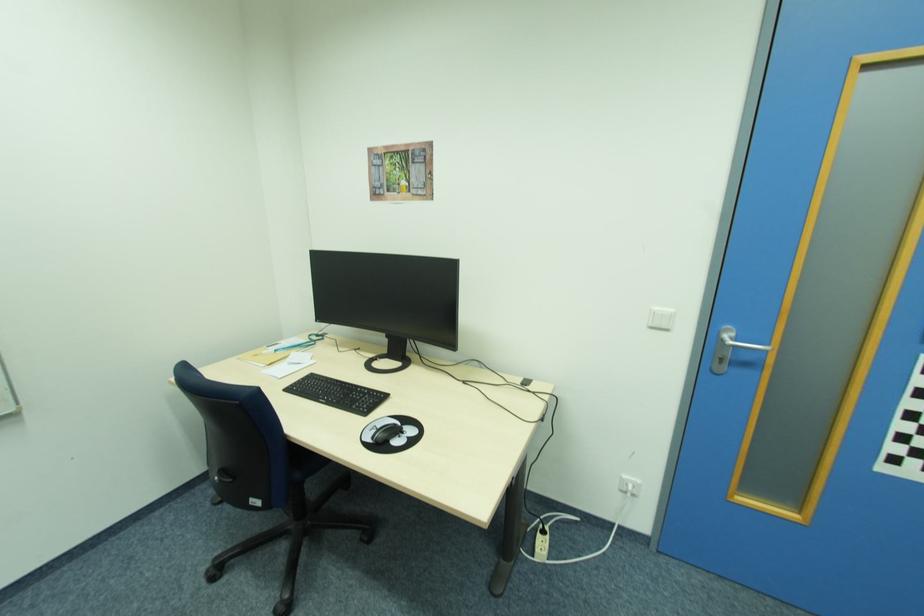
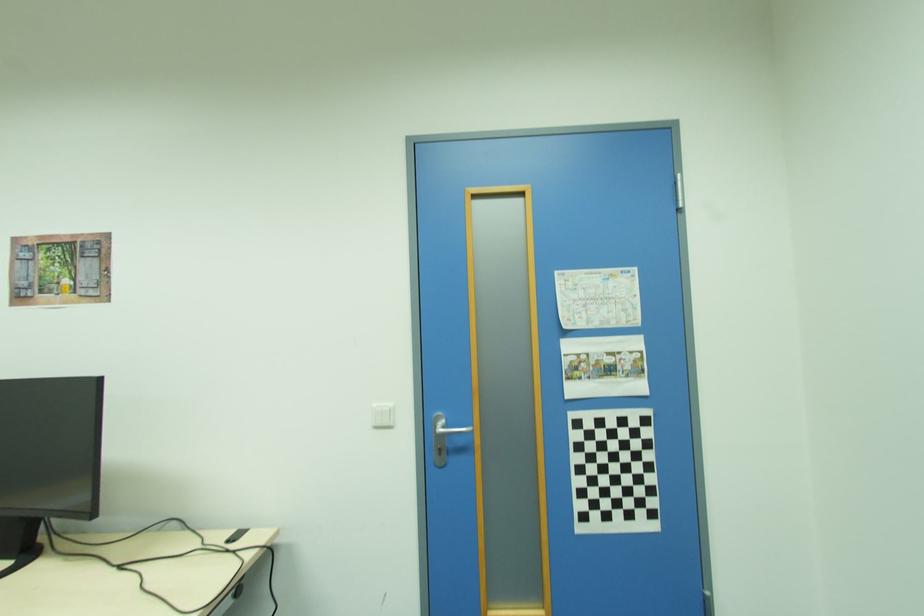
The point at (x=670, y=329) is marked in the first image. Where is the corresponding point in the second image?

(394, 427)